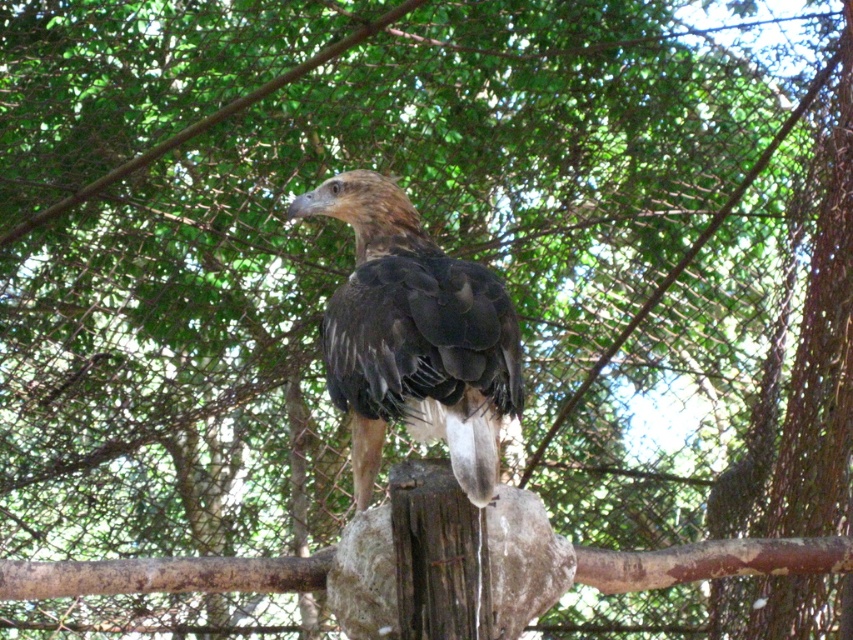
Question: Is brown feathered eagle at center further to the viewer compared to smooth gray stone at center?

Choices:
 (A) no
 (B) yes

Answer: (A)

Question: Does brown feathered eagle at center have a lesser width compared to smooth gray stone at center?

Choices:
 (A) yes
 (B) no

Answer: (B)

Question: Which of the following is the closest to the observer?

Choices:
 (A) brown feathered eagle at center
 (B) smooth gray stone at center

Answer: (A)

Question: Is brown feathered eagle at center to the right of smooth gray stone at center from the viewer's perspective?

Choices:
 (A) yes
 (B) no

Answer: (B)

Question: Which point appears closest to the camera in this image?

Choices:
 (A) (415, 378)
 (B) (384, 636)

Answer: (B)